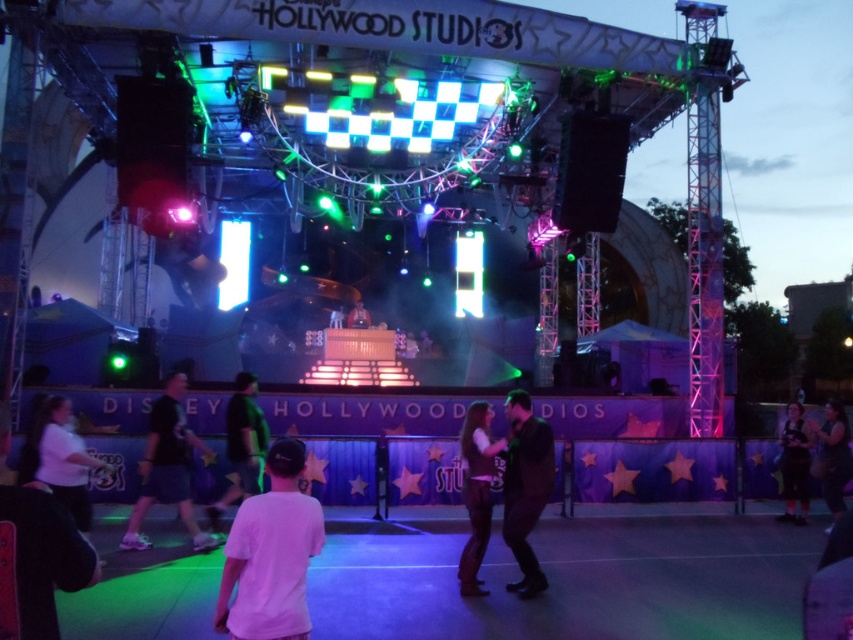
Is dark brown leather jacket at center smaller than matte black jacket at center?

Incorrect, dark brown leather jacket at center is not smaller in size than matte black jacket at center.

Who is positioned more to the left, dark brown leather jacket at center or matte black jacket at center?

From the viewer's perspective, matte black jacket at center appears more on the left side.

You are a GUI agent. You are given a task and a screenshot of the screen. Output one action in this format:
    pyautogui.click(x=<x>, y=<y>)
    Task: Click on the dark brown leather jacket at center
    The image size is (853, 640).
    Given the screenshot: What is the action you would take?
    pyautogui.click(x=476, y=492)

You are a GUI agent. You are given a task and a screenshot of the screen. Output one action in this format:
    pyautogui.click(x=<x>, y=<y>)
    Task: Click on the dark brown leather jacket at center
    Image resolution: width=853 pixels, height=640 pixels.
    Given the screenshot: What is the action you would take?
    pyautogui.click(x=476, y=492)

Looking at this image, who is positioned more to the left, dark brown suit at center or dark brown leather jacket at center?

dark brown leather jacket at center is more to the left.

Is dark brown suit at center wider than dark brown leather jacket at center?

Indeed, dark brown suit at center has a greater width compared to dark brown leather jacket at center.

At what (x,y) coordinates should I click in order to perform the action: click on dark brown suit at center. Please return your answer as a coordinate pair (x, y). This screenshot has width=853, height=640. Looking at the image, I should click on (525, 486).

Locate an element on the screen. The height and width of the screenshot is (640, 853). dark brown suit at center is located at coordinates (525, 486).

Which is below, white matte t-shirt at lower left or matte black jacket at center?

white matte t-shirt at lower left is below.

Can you confirm if white matte t-shirt at lower left is wider than matte black jacket at center?

Yes, white matte t-shirt at lower left is wider than matte black jacket at center.

The height and width of the screenshot is (640, 853). Identify the location of white matte t-shirt at lower left. (271, 554).